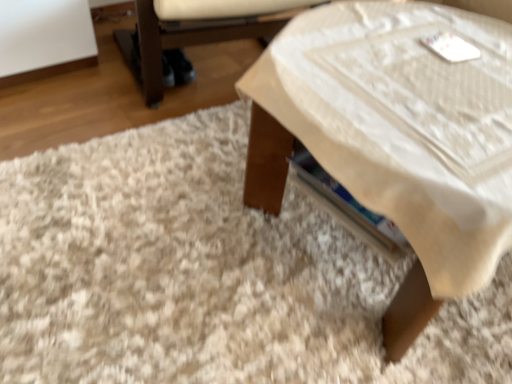
Image resolution: width=512 pixels, height=384 pixels. In order to click on white shaggy rug at lower left in this screenshot , I will do `click(206, 274)`.

The width and height of the screenshot is (512, 384). I want to click on white fabric armchair at lower right, so click(203, 28).

The width and height of the screenshot is (512, 384). Identify the location of table above the white fabric armchair at lower right (from a real-world perspective). (395, 138).

Would you say white fabric armchair at lower right is inside or outside wooden table at center?

white fabric armchair at lower right is outside wooden table at center.

Does white fabric armchair at lower right have a greater height compared to wooden table at center?

No.

From a real-world perspective, which is physically above, white fabric armchair at lower right or wooden table at center?

In real-world perspective, wooden table at center is above.

Which of these two, wooden table at center or white shaggy rug at lower left, is wider?

With larger width is white shaggy rug at lower left.

Is point (499, 224) closer or farther from the camera than point (329, 289)?

Point (499, 224) appears to be closer to the viewer than point (329, 289).

Which is more to the left, wooden table at center or white shaggy rug at lower left?

white shaggy rug at lower left is more to the left.

Looking at this image, from a real-world perspective, is wooden table at center below white shaggy rug at lower left?

Actually, wooden table at center is physically above white shaggy rug at lower left in the real world.

From the image's perspective, is wooden table at center over white fabric armchair at lower right?

No.

Considering the relative sizes of wooden table at center and white fabric armchair at lower right in the image provided, is wooden table at center bigger than white fabric armchair at lower right?

Indeed, wooden table at center has a larger size compared to white fabric armchair at lower right.

Looking at their sizes, would you say wooden table at center is wider or thinner than white fabric armchair at lower right?

wooden table at center is thinner than white fabric armchair at lower right.

From a real-world perspective, is white shaggy rug at lower left above or below wooden table at center?

Clearly, from a real-world perspective, white shaggy rug at lower left is below wooden table at center.

Is white shaggy rug at lower left closer to camera compared to wooden table at center?

No, white shaggy rug at lower left is behind wooden table at center.

In the scene shown: Is white shaggy rug at lower left not within wooden table at center?

white shaggy rug at lower left is positioned outside wooden table at center.

Does point (81, 201) appear closer or farther from the camera than point (465, 101)?

Clearly, point (81, 201) is more distant from the camera than point (465, 101).

From the image's perspective, is white shaggy rug at lower left positioned above or below white fabric armchair at lower right?

From the image's perspective, white shaggy rug at lower left appears below white fabric armchair at lower right.

Is point (223, 204) more distant than point (177, 21)?

That is False.

From the picture: Is white shaggy rug at lower left oriented towards white fabric armchair at lower right?

No, white shaggy rug at lower left is not aimed at white fabric armchair at lower right.

Is white fabric armchair at lower right located outside white shaggy rug at lower left?

Yes.

What's the angular difference between white fabric armchair at lower right and white shaggy rug at lower left's facing directions?

The facing directions of white fabric armchair at lower right and white shaggy rug at lower left are 7.08 degrees apart.

Does white fabric armchair at lower right have a smaller size compared to white shaggy rug at lower left?

No.

How far apart are white fabric armchair at lower right and white shaggy rug at lower left?

white fabric armchair at lower right and white shaggy rug at lower left are 57.33 centimeters apart from each other.

The image size is (512, 384). I want to click on armchair above the wooden table at center (from the image's perspective), so (x=203, y=28).

The height and width of the screenshot is (384, 512). What are the coordinates of `table above the white shaggy rug at lower left (from a real-world perspective)` in the screenshot? It's located at point(395,138).

Based on their spatial positions, is white shaggy rug at lower left or wooden table at center further from white fabric armchair at lower right?

Among the two, wooden table at center is located further to white fabric armchair at lower right.

Estimate the real-world distances between objects in this image. Which object is closer to white shaggy rug at lower left, white fabric armchair at lower right or wooden table at center?

wooden table at center is positioned closer to the anchor white shaggy rug at lower left.

When comparing their distances from wooden table at center, does white shaggy rug at lower left or white fabric armchair at lower right seem closer?

The object closer to wooden table at center is white shaggy rug at lower left.

Based on their spatial positions, is wooden table at center or white fabric armchair at lower right closer to white shaggy rug at lower left?

Among the two, wooden table at center is located nearer to white shaggy rug at lower left.

Looking at the image, which one is located further to white fabric armchair at lower right, wooden table at center or white shaggy rug at lower left?

Based on the image, wooden table at center appears to be further to white fabric armchair at lower right.

Looking at this image, based on their spatial positions, is white fabric armchair at lower right or white shaggy rug at lower left further from wooden table at center?

Among the two, white fabric armchair at lower right is located further to wooden table at center.

Find the location of `table between white fabric armchair at lower right and white shaggy rug at lower left vertically`. table between white fabric armchair at lower right and white shaggy rug at lower left vertically is located at coordinates (395, 138).